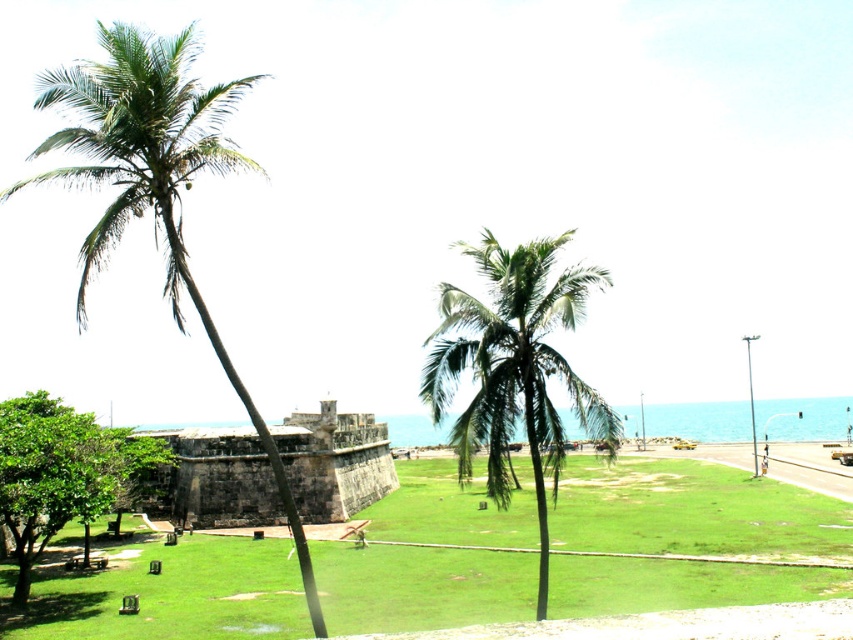
Question: Which point is closer to the camera?

Choices:
 (A) green leafy coconut tree at center
 (B) green grassy at center

Answer: (B)

Question: Is green leafy coconut tree at center wider than brown stone fort at center?

Choices:
 (A) yes
 (B) no

Answer: (B)

Question: Which point is farther to the camera?

Choices:
 (A) (258, 524)
 (B) (524, 566)
 (C) (544, 412)

Answer: (A)

Question: Can you confirm if green leafy palm tree at left is bigger than brown stone fort at center?

Choices:
 (A) yes
 (B) no

Answer: (A)

Question: Based on their relative distances, which object is farther from the green grassy at center?

Choices:
 (A) green leafy palm tree at left
 (B) brown stone fort at center

Answer: (A)

Question: Where is green grassy at center located in relation to green leafy coconut tree at center in the image?

Choices:
 (A) left
 (B) right

Answer: (B)